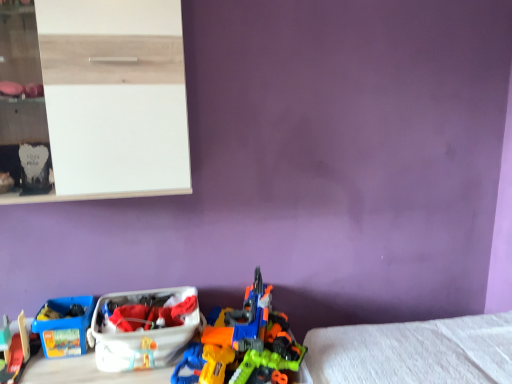
Question: From a real-world perspective, relative to white glossy shelf at upper left, is smooth plastic toy train at lower left, the 2th toy when ordered from right to left, vertically above or below?

Choices:
 (A) above
 (B) below

Answer: (B)

Question: Based on their sizes in the image, would you say smooth plastic toy train at lower left, the 2th toy when ordered from right to left, is bigger or smaller than white glossy shelf at upper left?

Choices:
 (A) big
 (B) small

Answer: (B)

Question: Estimate the real-world distances between objects in this image. Which object is farther from the orange plastic toy gun at center, which is the 1th toy in right-to-left order?

Choices:
 (A) white glossy shelf at upper left
 (B) white plastic storage box at lower left, positioned as the 2th storage box in left-to-right order
 (C) smooth plastic toy train at lower left, the 2th toy when ordered from right to left
 (D) blue plastic storage box at lower left, which is the 2th storage box in right-to-left order

Answer: (A)

Question: Which object is positioned closest to the white glossy shelf at upper left?

Choices:
 (A) white plastic storage box at lower left, which appears as the first storage box when viewed from the right
 (B) orange plastic toy gun at center, which is the 1th toy in right-to-left order
 (C) blue plastic storage box at lower left, the 1th storage box in the left-to-right sequence
 (D) smooth plastic toy train at lower left, the 2th toy when ordered from right to left

Answer: (A)